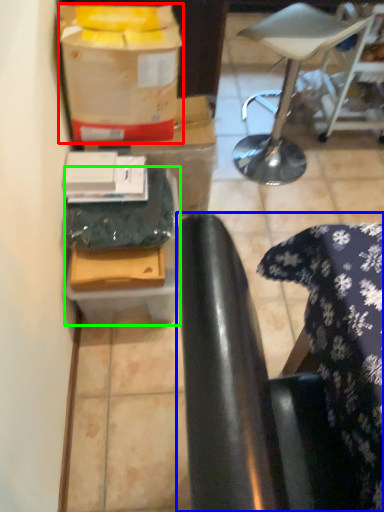
Question: Considering the real-world distances, which object is farthest from wrapping paper (highlighted by a red box)? chair (highlighted by a blue box) or cardboard box (highlighted by a green box)?

Choices:
 (A) chair
 (B) cardboard box

Answer: (A)